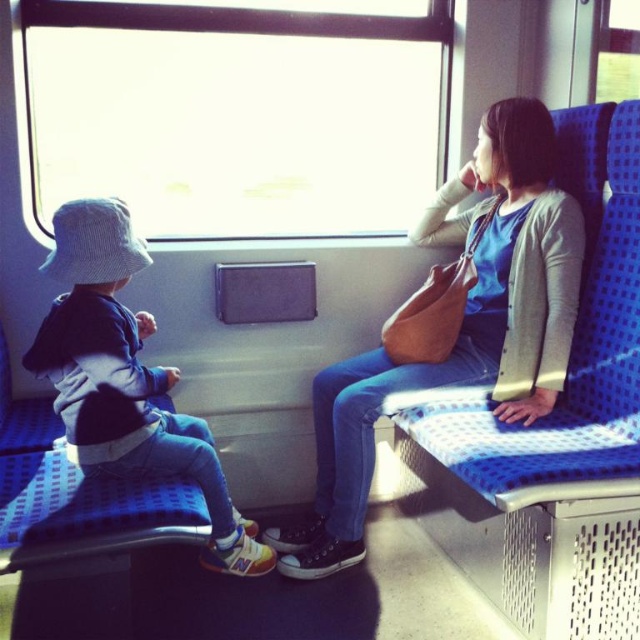
Question: Which object is closer to the camera taking this photo?

Choices:
 (A) matte brown purse at center
 (B) denim pants at left

Answer: (B)

Question: Is transparent glass window at upper center below matte brown purse at center?

Choices:
 (A) yes
 (B) no

Answer: (B)

Question: Is transparent glass window at upper center positioned before denim pants at left?

Choices:
 (A) yes
 (B) no

Answer: (B)

Question: Does transparent glass window at upper center have a larger size compared to matte brown purse at center?

Choices:
 (A) no
 (B) yes

Answer: (B)

Question: Among these points, which one is nearest to the camera?

Choices:
 (A) (292, 131)
 (B) (128, 364)
 (C) (355, 515)

Answer: (B)

Question: Which of the following is the farthest from the observer?

Choices:
 (A) denim pants at left
 (B) transparent glass window at upper center
 (C) matte brown purse at center

Answer: (B)